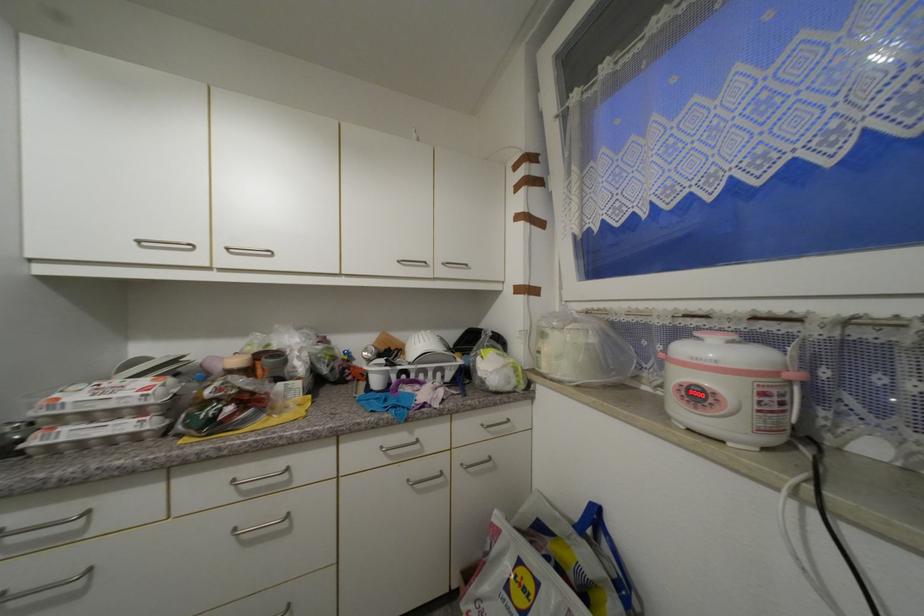
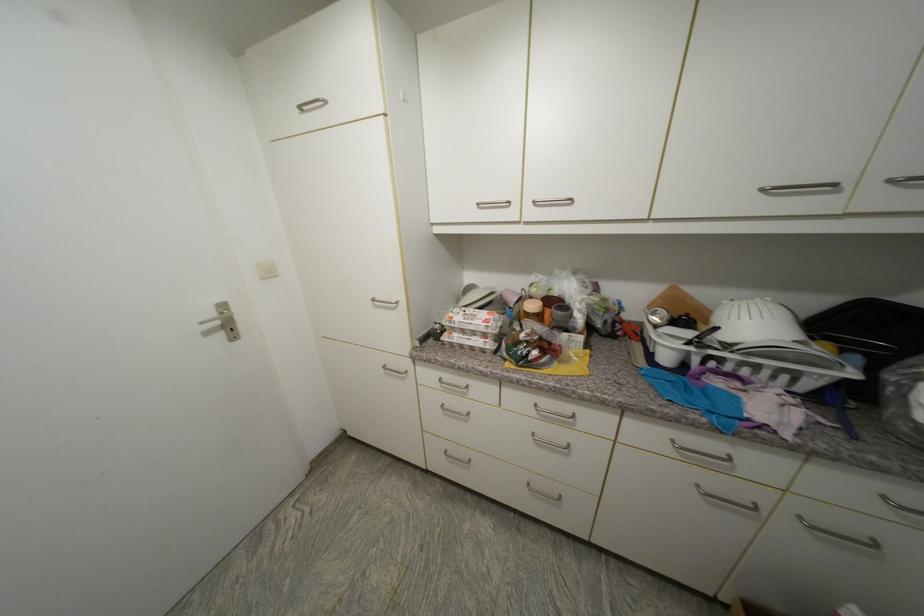
The point at (242, 363) is marked in the first image. Where is the corresponding point in the second image?

(538, 307)